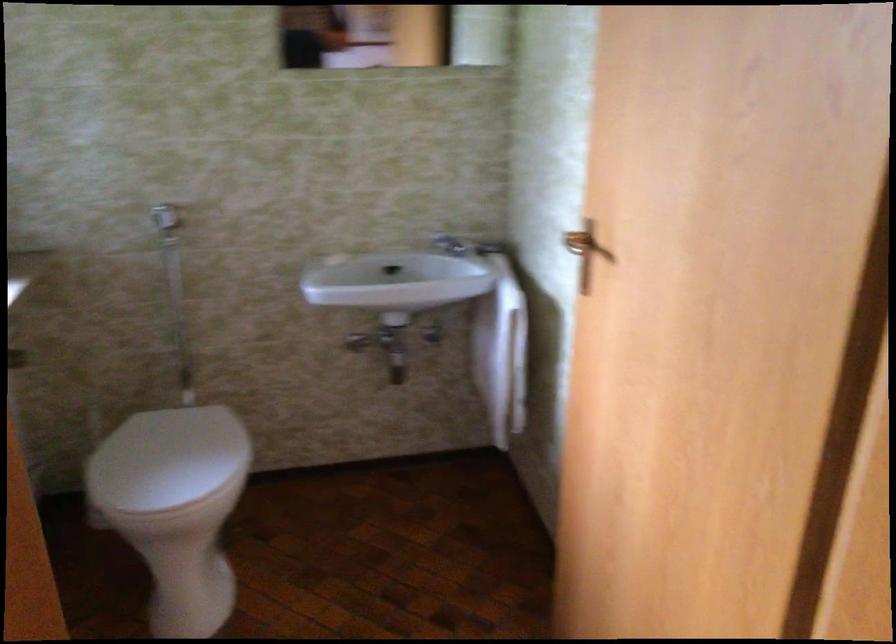
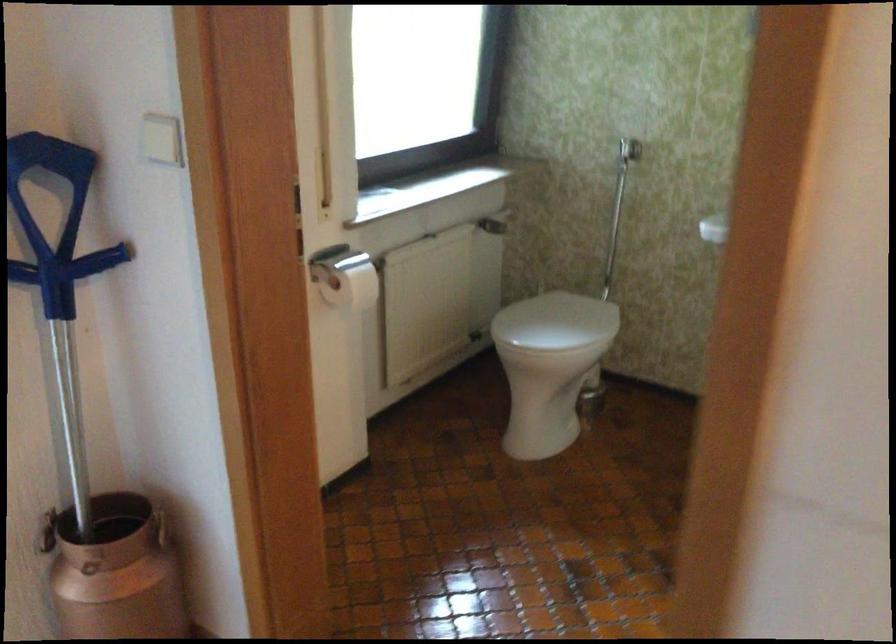
Question: Based on the continuous images, in which direction is the camera rotating? Reply with the corresponding letter.

Choices:
 (A) Left
 (B) Right
 (C) Up
 (D) Down

Answer: (A)